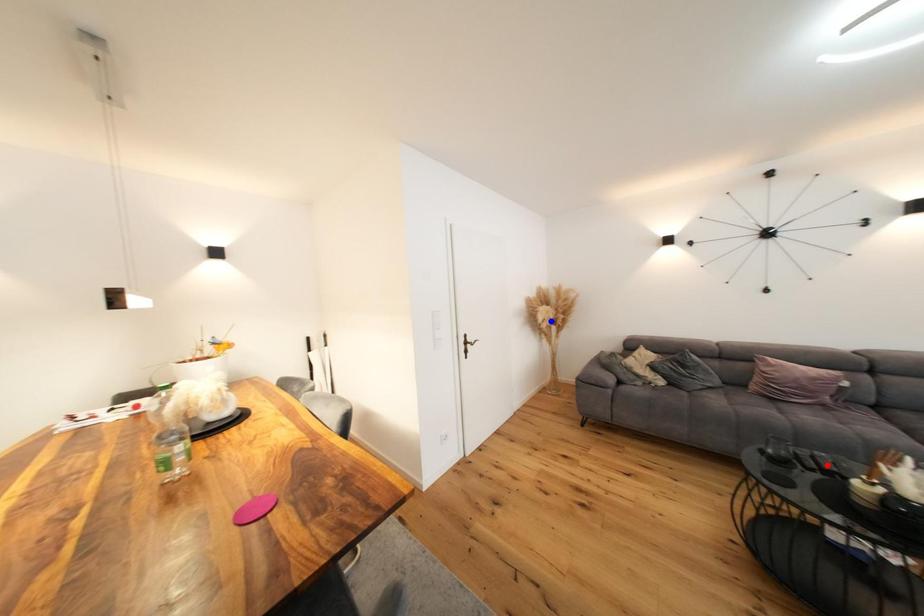
Question: In the image, two points are highlighted. Which point is nearer to the camera? Reply with the corresponding letter.

Choices:
 (A) blue point
 (B) red point

Answer: (B)